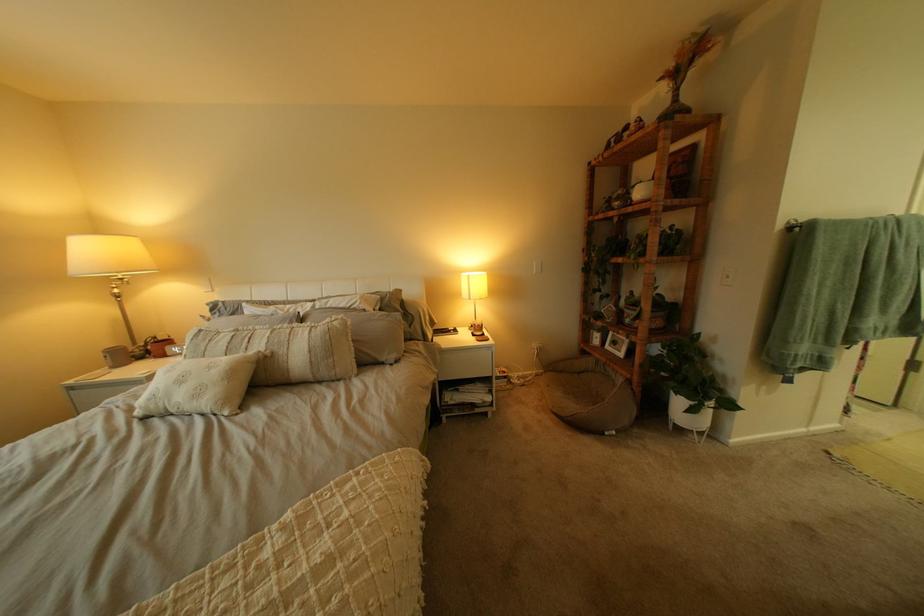
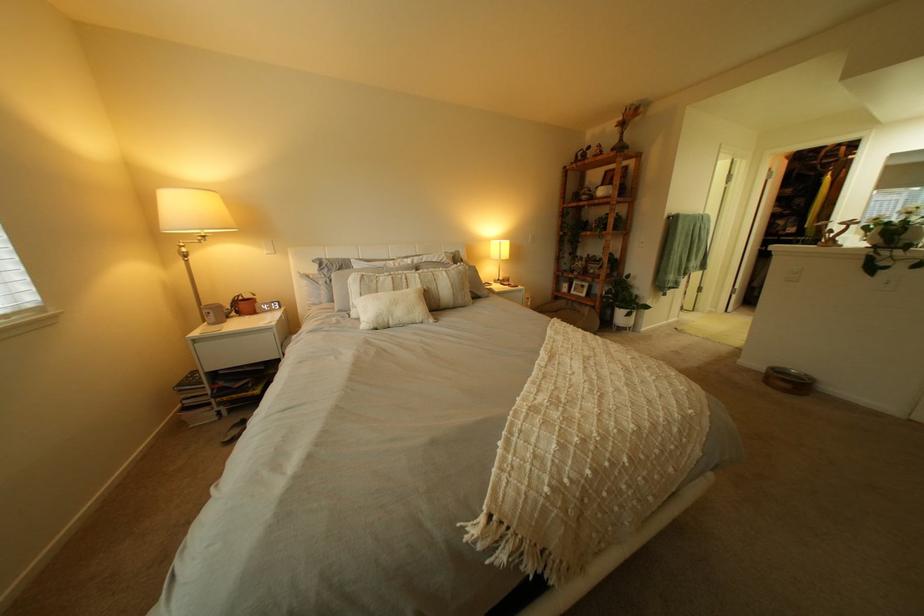
What movement of the cameraman would produce the second image?

The cameraman walked toward left, backward.